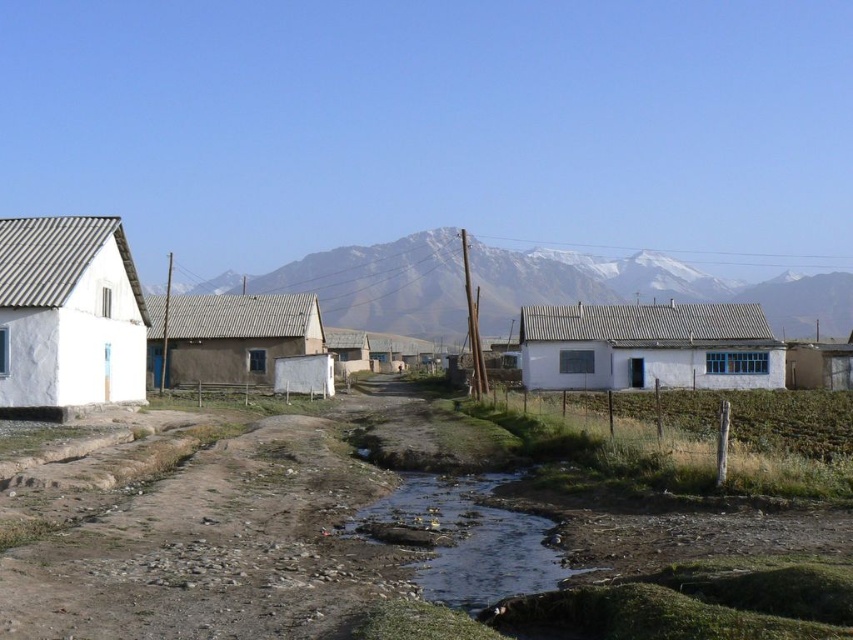
Question: Where is brown gravel dirt track at lower center located in relation to white stucco house at left in the image?

Choices:
 (A) below
 (B) above

Answer: (A)

Question: Is white snow-covered mountain at center to the left of white stucco house at left from the viewer's perspective?

Choices:
 (A) no
 (B) yes

Answer: (A)

Question: Can you confirm if white matte house at center is positioned to the right of brown muddy stream at center?

Choices:
 (A) no
 (B) yes

Answer: (B)

Question: Considering the real-world distances, which object is closest to the brown mudbrick house at center?

Choices:
 (A) brown gravel dirt track at lower center
 (B) brown soil at center

Answer: (B)

Question: Which object is the farthest from the white snow-covered mountain at center?

Choices:
 (A) white matte house at center
 (B) brown gravel dirt track at lower center

Answer: (B)

Question: Considering the real-world distances, which object is farthest from the brown mudbrick house at center?

Choices:
 (A) brown muddy stream at center
 (B) brown soil at center
 (C) brown gravel dirt track at lower center
 (D) white matte house at center

Answer: (A)